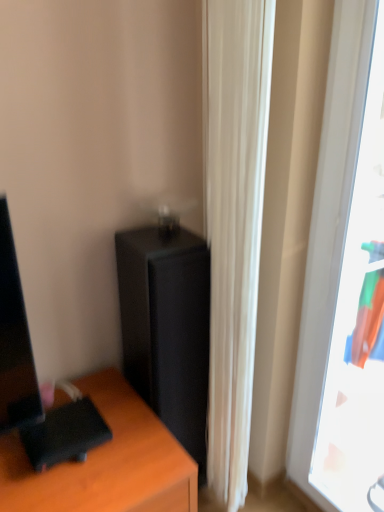
Locate an element on the screen. This screenshot has height=512, width=384. transparent plastic window at right is located at coordinates (345, 281).

From the image's perspective, who appears lower, white fabric curtain at center or black matte/file cabinet at center?

From the image's view, black matte/file cabinet at center is below.

The width and height of the screenshot is (384, 512). Find the location of `curtain located above the black matte/file cabinet at center (from a real-world perspective)`. curtain located above the black matte/file cabinet at center (from a real-world perspective) is located at coordinates (234, 221).

Is white fabric curtain at center behind black matte/file cabinet at center?

No.

Is transparent plastic window at right taller than black matte/file cabinet at center?

Yes, transparent plastic window at right is taller than black matte/file cabinet at center.

In the scene shown: From the image's perspective, between transparent plastic window at right and black matte/file cabinet at center, which one is located above?

transparent plastic window at right.

Considering the relative sizes of transparent plastic window at right and black matte/file cabinet at center in the image provided, is transparent plastic window at right smaller than black matte/file cabinet at center?

Yes.

Would you say black matte/file cabinet at center is part of transparent plastic window at right's contents?

Definitely not — black matte/file cabinet at center is not inside transparent plastic window at right.

Is black matte/file cabinet at center directly adjacent to white fabric curtain at center?

No, black matte/file cabinet at center is not making contact with white fabric curtain at center.

Which is behind, point (196, 377) or point (241, 45)?

The point (196, 377) is behind.

Who is shorter, black matte/file cabinet at center or white fabric curtain at center?

With less height is black matte/file cabinet at center.

Based on their sizes in the image, would you say black matte/file cabinet at center is bigger or smaller than white fabric curtain at center?

black matte/file cabinet at center is bigger than white fabric curtain at center.

Is white fabric curtain at center next to transparent plastic window at right?

No, white fabric curtain at center is not touching transparent plastic window at right.

What's the angular difference between white fabric curtain at center and transparent plastic window at right's facing directions?

They differ by 0.701 degrees in their facing directions.

Is point (251, 205) positioned after point (374, 102)?

No.

From a real-world perspective, is white fabric curtain at center located beneath transparent plastic window at right?

Yes, from a real-world perspective, white fabric curtain at center is under transparent plastic window at right.

Is black matte/file cabinet at center facing away from transparent plastic window at right?

black matte/file cabinet at center does not have its back to transparent plastic window at right.

This screenshot has width=384, height=512. Find the location of `window that is above the black matte/file cabinet at center (from a real-world perspective)`. window that is above the black matte/file cabinet at center (from a real-world perspective) is located at coordinates (345, 281).

Which is more to the left, black matte/file cabinet at center or transparent plastic window at right?

Positioned to the left is black matte/file cabinet at center.

From their relative heights in the image, would you say black matte/file cabinet at center is taller or shorter than transparent plastic window at right?

Considering their sizes, black matte/file cabinet at center has less height than transparent plastic window at right.

From a real-world perspective, which is physically below, transparent plastic window at right or white fabric curtain at center?

From a 3D spatial view, white fabric curtain at center is below.

Is transparent plastic window at right to the left or to the right of white fabric curtain at center in the image?

transparent plastic window at right is to the right of white fabric curtain at center.

Is transparent plastic window at right not near white fabric curtain at center?

No, transparent plastic window at right is not far away from white fabric curtain at center.

Which is closer to the camera, (342, 141) or (232, 313)?

Positioned in front is point (342, 141).

Find the location of a particular element. This screenshot has height=512, width=384. file cabinet that is under the white fabric curtain at center (from a real-world perspective) is located at coordinates (167, 328).

Locate an element on the screen. The width and height of the screenshot is (384, 512). file cabinet below the transparent plastic window at right (from the image's perspective) is located at coordinates (167, 328).

Based on their spatial positions, is black matte/file cabinet at center or transparent plastic window at right closer to white fabric curtain at center?

Among the two, black matte/file cabinet at center is located nearer to white fabric curtain at center.

Looking at this image, considering their positions, is black matte/file cabinet at center positioned closer to transparent plastic window at right than white fabric curtain at center?

white fabric curtain at center is closer to transparent plastic window at right.

Consider the image. When comparing their distances from white fabric curtain at center, does transparent plastic window at right or black matte/file cabinet at center seem further?

transparent plastic window at right.

Estimate the real-world distances between objects in this image. Which object is closer to black matte/file cabinet at center, white fabric curtain at center or transparent plastic window at right?

white fabric curtain at center.

Considering their positions, is white fabric curtain at center positioned further to transparent plastic window at right than black matte/file cabinet at center?

The object further to transparent plastic window at right is black matte/file cabinet at center.

Estimate the real-world distances between objects in this image. Which object is closer to black matte/file cabinet at center, transparent plastic window at right or white fabric curtain at center?

white fabric curtain at center lies closer to black matte/file cabinet at center than the other object.

I want to click on curtain between black matte/file cabinet at center and transparent plastic window at right in the horizontal direction, so click(234, 221).